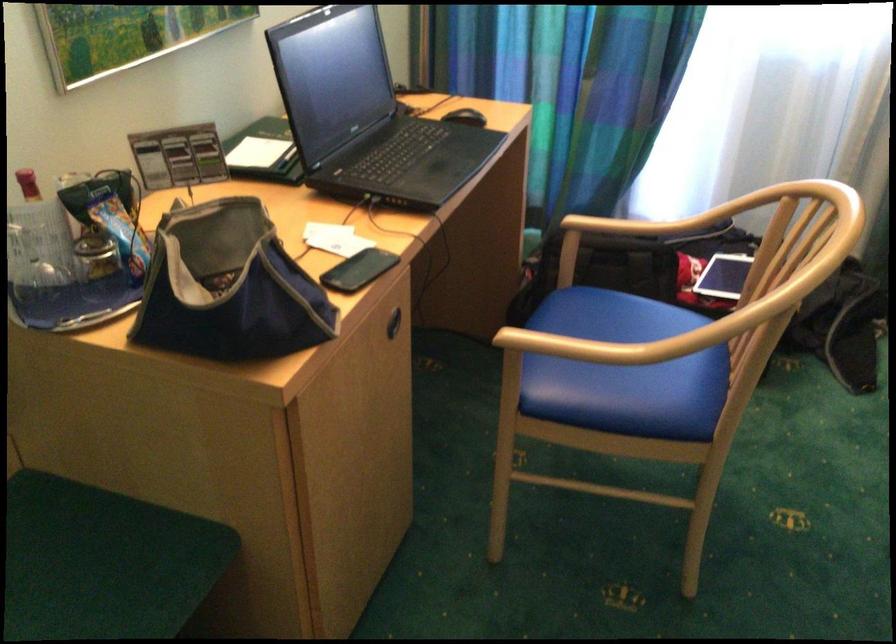
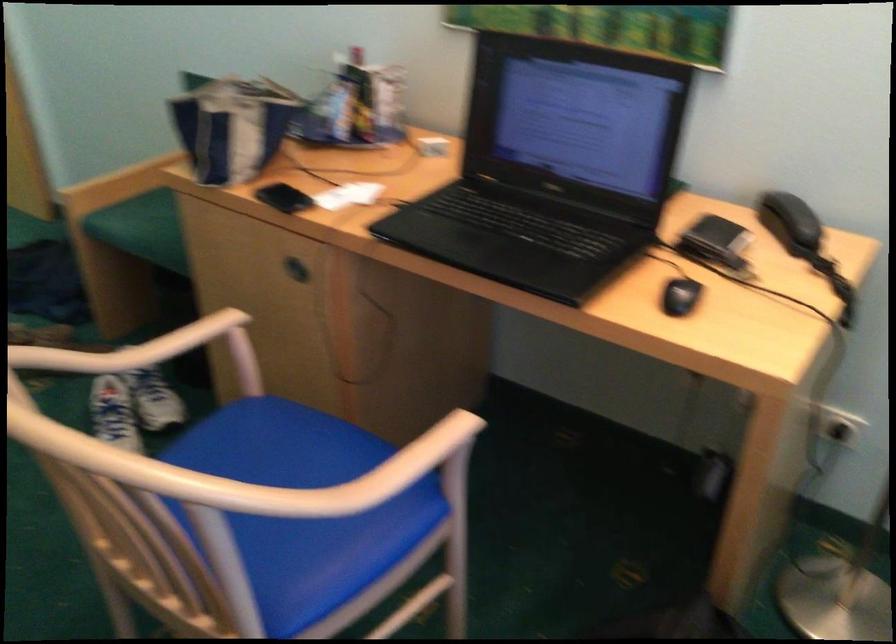
Where in the second image is the point corresponding to (608,346) from the first image?

(167, 365)